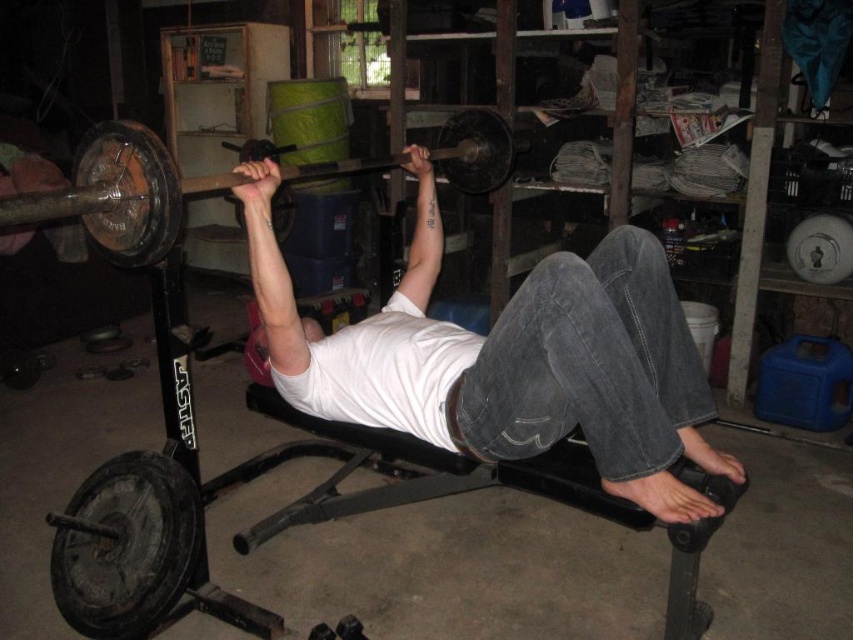
Question: Is white matte shirt at center positioned at the back of rusty metal barbell at center?

Choices:
 (A) no
 (B) yes

Answer: (B)

Question: Which point is farther to the camera?

Choices:
 (A) rusty metal barbell at center
 (B) white matte shirt at center

Answer: (B)

Question: Does white matte shirt at center lie in front of rusty metal barbell at center?

Choices:
 (A) yes
 (B) no

Answer: (B)

Question: Can you confirm if white matte shirt at center is positioned to the left of rusty metal barbell at center?

Choices:
 (A) yes
 (B) no

Answer: (B)